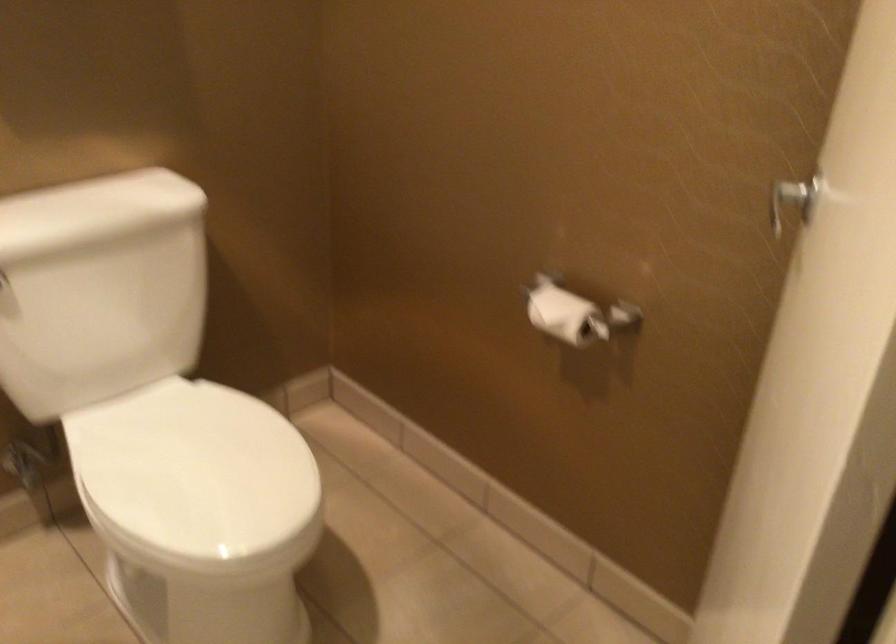
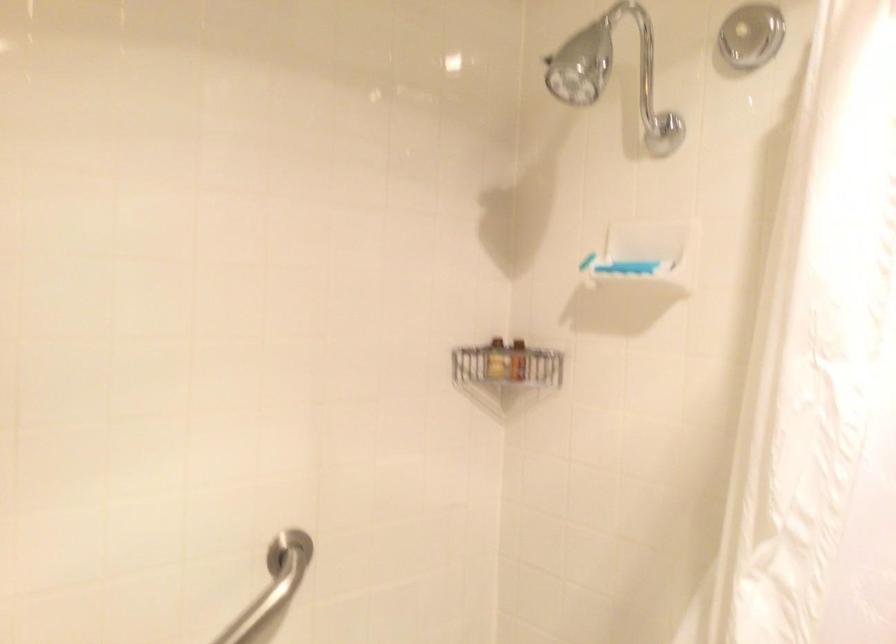
Question: The camera is either moving clockwise (left) or counter-clockwise (right) around the object. The first image is from the beginning of the video and the second image is from the end. Is the camera moving left or right when shooting the video?

Choices:
 (A) Left
 (B) Right

Answer: (B)